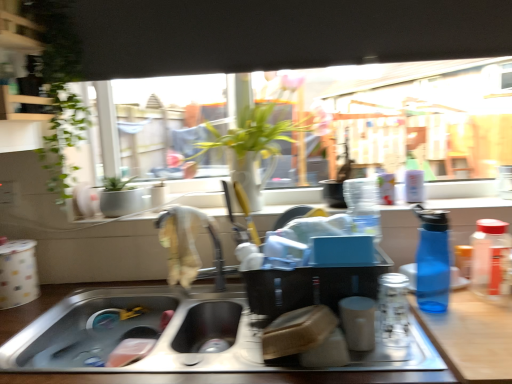
Question: Does point (435, 263) appear closer or farther from the camera than point (475, 332)?

Choices:
 (A) closer
 (B) farther

Answer: (B)

Question: Is blue translucent bottle at right, which appears as the 2th bottle when viewed from the right, taller or shorter than stainless steel sink at lower center?

Choices:
 (A) short
 (B) tall

Answer: (B)

Question: Which is farther from the wooden counter at lower right?

Choices:
 (A) transparent glass window at center
 (B) matte black container at center
 (C) silver metallic faucet at center
 (D) green leafy plant at center
 (E) blue translucent bottle at right, which appears as the 2th bottle when viewed from the right

Answer: (D)

Question: Which of these objects is positioned farthest from the blue translucent bottle at right, which is the second bottle from left to right?

Choices:
 (A) matte black container at center
 (B) transparent glass jar at right, arranged as the first bottle when viewed from the right
 (C) green leafy plant at center
 (D) clear glass jar at center, the 3th bottle in the right-to-left sequence
 (E) stainless steel sink at lower center

Answer: (C)